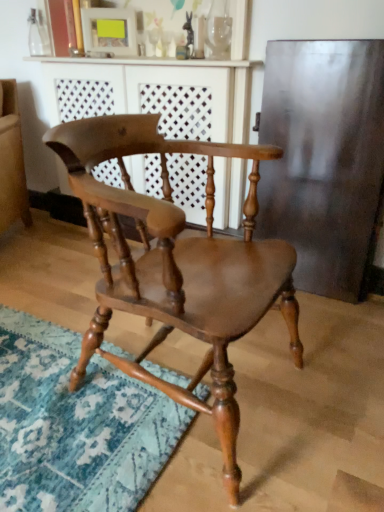
Question: Is wooden dresser at center at the right side of shiny brown wood chair at center?

Choices:
 (A) yes
 (B) no

Answer: (B)

Question: Considering the relative sizes of wooden dresser at center and shiny brown wood chair at center in the image provided, is wooden dresser at center thinner than shiny brown wood chair at center?

Choices:
 (A) yes
 (B) no

Answer: (A)

Question: Can you confirm if wooden dresser at center is positioned to the left of shiny brown wood chair at center?

Choices:
 (A) no
 (B) yes

Answer: (B)

Question: Is wooden dresser at center next to shiny brown wood chair at center and touching it?

Choices:
 (A) no
 (B) yes

Answer: (A)

Question: Can you confirm if wooden dresser at center is wider than shiny brown wood chair at center?

Choices:
 (A) no
 (B) yes

Answer: (A)

Question: Is shiny brown wood chair at center located within wooden dresser at center?

Choices:
 (A) no
 (B) yes

Answer: (A)

Question: Can you confirm if shiny brown wood chair at center is thinner than wooden dresser at center?

Choices:
 (A) yes
 (B) no

Answer: (B)

Question: Does shiny brown wood chair at center have a larger size compared to wooden dresser at center?

Choices:
 (A) yes
 (B) no

Answer: (B)

Question: Does shiny brown wood chair at center appear on the right side of wooden dresser at center?

Choices:
 (A) no
 (B) yes

Answer: (B)

Question: Is shiny brown wood chair at center wider than wooden dresser at center?

Choices:
 (A) yes
 (B) no

Answer: (A)

Question: Can you confirm if shiny brown wood chair at center is taller than wooden dresser at center?

Choices:
 (A) no
 (B) yes

Answer: (A)

Question: Considering the relative positions of shiny brown wood chair at center and wooden dresser at center in the image provided, is shiny brown wood chair at center behind wooden dresser at center?

Choices:
 (A) yes
 (B) no

Answer: (B)

Question: Is wooden dresser at center taller or shorter than shiny brown wood chair at center?

Choices:
 (A) tall
 (B) short

Answer: (A)